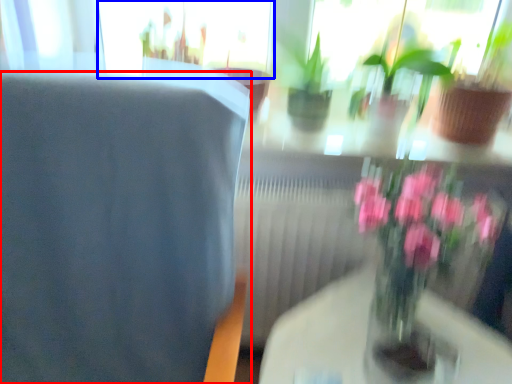
Question: Among these objects, which one is nearest to the camera, chair (highlighted by a red box) or glass door (highlighted by a blue box)?

Choices:
 (A) chair
 (B) glass door

Answer: (A)